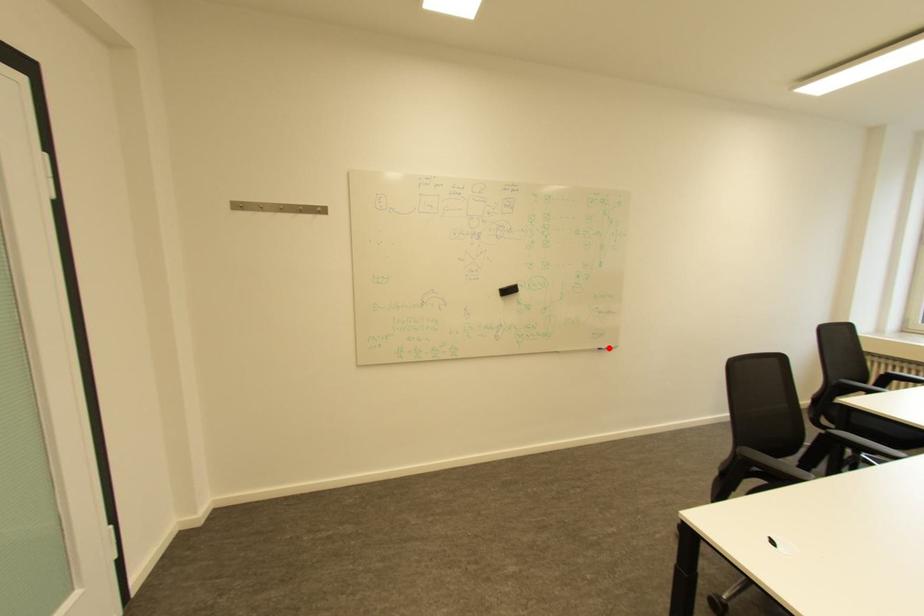
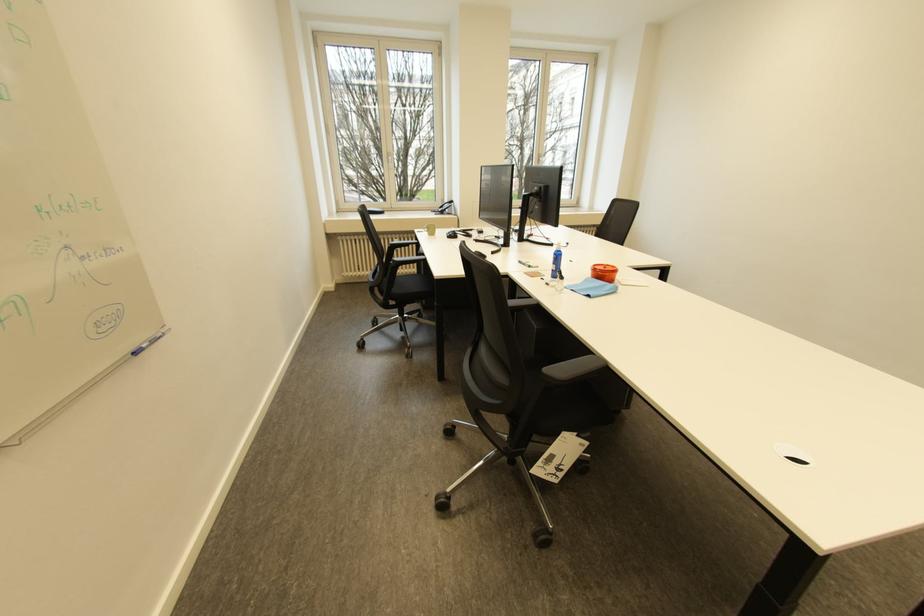
Locate, in the second image, the point that corresponds to the highlighted location in the first image.

(141, 350)